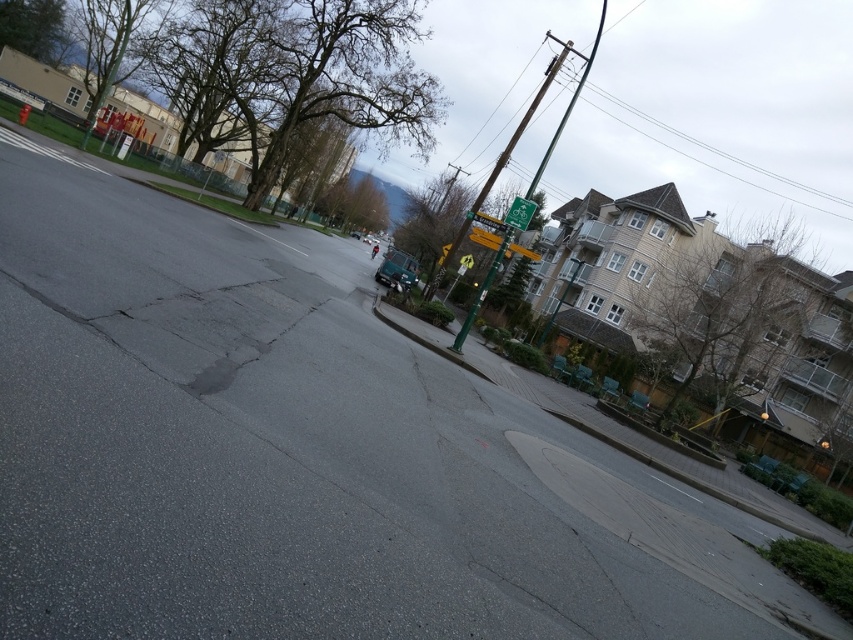
Between point (480, 301) and point (474, 230), which one is positioned behind?

Point (474, 230)

Looking at this image, which is more to the left, green painted wood utility pole at upper right or metallic yellow traffic sign at upper right?

Positioned to the left is metallic yellow traffic sign at upper right.

The width and height of the screenshot is (853, 640). What do you see at coordinates (567, 106) in the screenshot?
I see `green painted wood utility pole at upper right` at bounding box center [567, 106].

Identify the location of green painted wood utility pole at upper right. This screenshot has width=853, height=640. (567, 106).

Who is more distant from viewer, [415,275] or [490,220]?

Positioned behind is point [415,275].

Who is more forward, (408, 260) or (495, 227)?

Point (495, 227)

This screenshot has height=640, width=853. In order to click on metallic green car at center in this screenshot , I will do `click(397, 269)`.

Can you confirm if green painted wood utility pole at upper right is positioned below metallic green car at center?

No.

Between green painted wood utility pole at upper right and metallic green car at center, which one has more height?

green painted wood utility pole at upper right

Who is more distant from viewer, (555, 136) or (398, 262)?

The point (555, 136) is more distant.

Identify the location of green painted wood utility pole at upper right. The height and width of the screenshot is (640, 853). (567, 106).